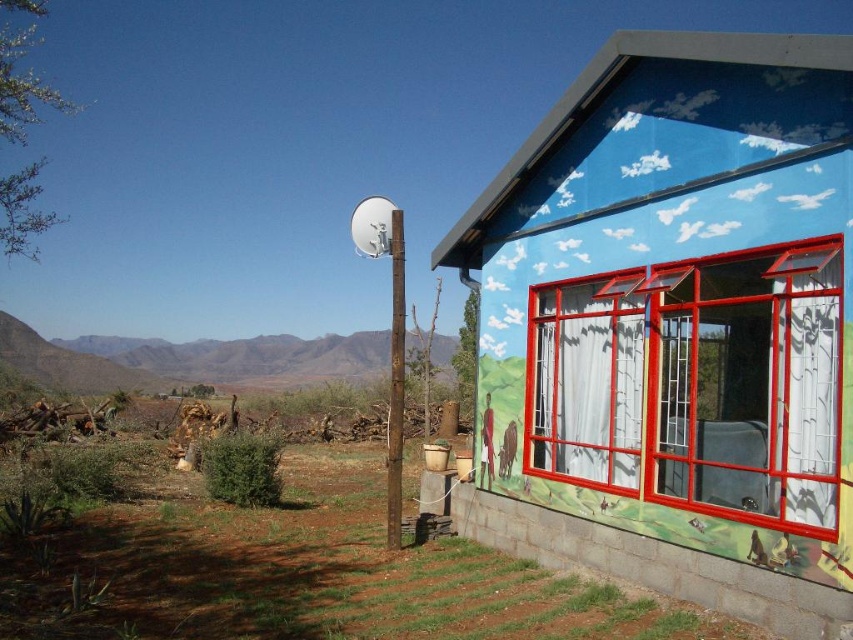
You are an artist planning to paint a mural on the blue painted wall at upper right and the clear glass window at right. Which surface will require less paint because of its size?

The blue painted wall at upper right has a smaller size compared to the clear glass window at right, so it will require less paint.

You are an architect designing a new addition to the building. You need to know the spatial relationship between the blue painted wall at upper right and the clear glass window at right. Which one is wider?

The blue painted wall at upper right is less wide than the clear glass window at right, so the clear glass window at right is wider.

You are standing at the center of the image. There is a point marked at coordinates (679, 320). What object is located at that point?

The blue painted wall at upper right is located at point (679, 320).